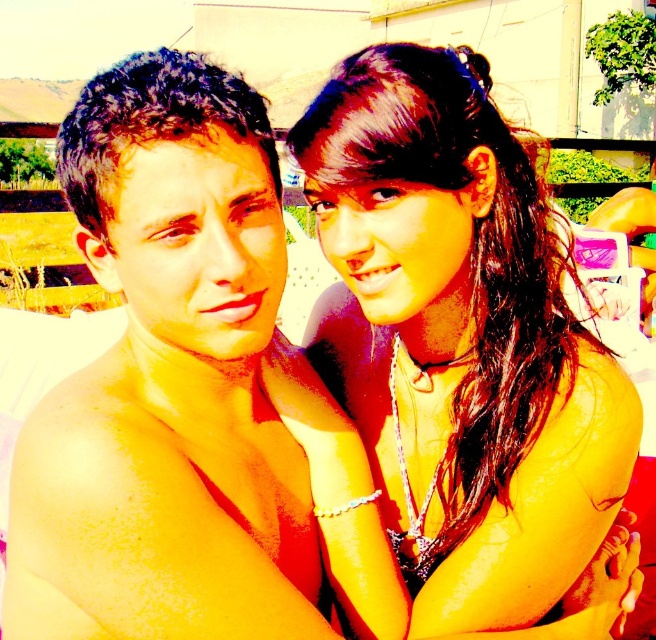
Based on the photo, how far apart are satin black bikini top at upper right and shiny skin at left?

satin black bikini top at upper right and shiny skin at left are 12.95 inches apart from each other.

Does satin black bikini top at upper right have a larger size compared to shiny skin at left?

Yes, satin black bikini top at upper right is bigger than shiny skin at left.

Which is behind, point (464, 60) or point (121, 625)?

The point (464, 60) is more distant.

Where is `satin black bikini top at upper right`? This screenshot has height=640, width=656. satin black bikini top at upper right is located at coordinates (459, 339).